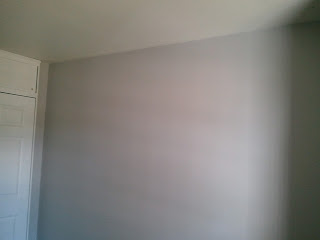
This screenshot has height=240, width=320. In order to click on white ceiling in this screenshot , I will do `click(79, 36)`.